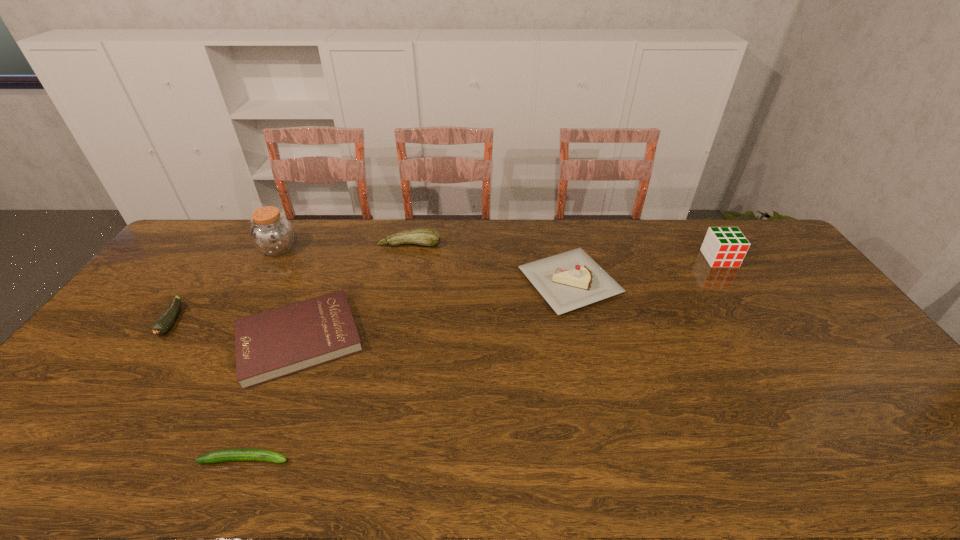
At what (x,y) coordinates should I click in order to perform the action: click on jar. Please return your answer as a coordinate pair (x, y). The image size is (960, 540). Looking at the image, I should click on (271, 233).

What are the coordinates of `cube` in the screenshot? It's located at click(x=725, y=246).

This screenshot has width=960, height=540. I want to click on the rightmost object, so click(x=725, y=246).

The image size is (960, 540). Identify the location of cake. (567, 281).

Identify the location of the sixth object from left to right. (567, 281).

At what (x,y) coordinates should I click in order to perform the action: click on the fourth shortest object. Please return your answer as a coordinate pair (x, y). Looking at the image, I should click on (426, 237).

The image size is (960, 540). Find the location of `the tallest zucchini`. the tallest zucchini is located at coordinates (426, 237).

Identify the location of the second farthest zucchini. (164, 323).

Find the location of a particular element. the leftmost object is located at coordinates 164,323.

Identify the location of hardback book. (275, 343).